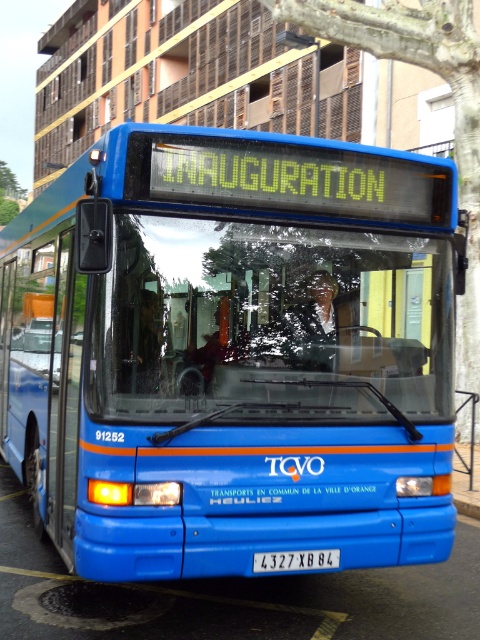
You are a bus inspector checking the front panel of the bus. You need to determine if the transparent glass windshield at center is wider than the white plastic license plate at center. Based on the scene description, what is your conclusion?

The transparent glass windshield at center has a width larger than the white plastic license plate at center, so yes, the windshield is wider than the license plate.

You are a city inspector checking license plates for compliance. You notice the white plastic license plate at center is partially hidden. Can you determine if the blue matte bus at center is obstructing the license plate?

The blue matte bus at center is positioned over white plastic license plate at center, so yes, the blue matte bus at center is obstructing the license plate.

You are standing on a sidewalk and see the blue matte bus at center. If you want to take a photo of it from where you are standing, will you be able to fit the entire bus into the frame of your smartphone camera without moving closer or farther away?

The blue matte bus at center is 12.47 feet away from you. Since smartphones typically have a wide enough angle to capture objects at this distance within the frame, you should be able to fit the entire bus into the photo without moving closer or farther away.